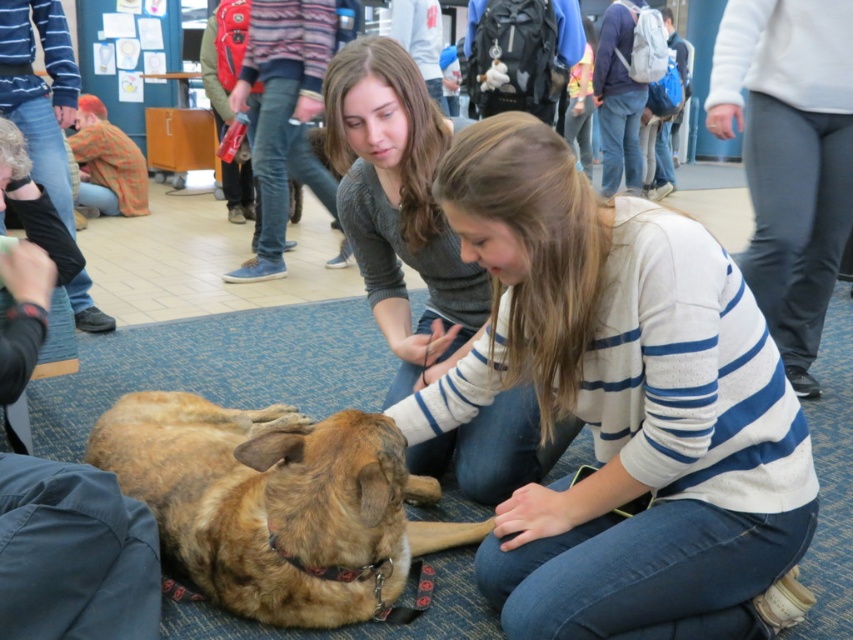
Question: Is striped sweater at center bigger than brown fur dog at lower left?

Choices:
 (A) yes
 (B) no

Answer: (B)

Question: Which point is farther to the camera?

Choices:
 (A) (216, 419)
 (B) (349, 97)

Answer: (A)

Question: Based on their relative distances, which object is nearer to the brown fur dog at lower left?

Choices:
 (A) striped sweater at center
 (B) gray sweater at center
 (C) brown fur dog at center

Answer: (C)

Question: Does brown fur dog at center appear over gray sweater at center?

Choices:
 (A) yes
 (B) no

Answer: (B)

Question: Can you confirm if striped sweater at center is smaller than brown fur dog at lower left?

Choices:
 (A) no
 (B) yes

Answer: (B)

Question: Estimate the real-world distances between objects in this image. Which object is closer to the striped sweater at center?

Choices:
 (A) gray sweater at center
 (B) brown fur dog at center

Answer: (B)